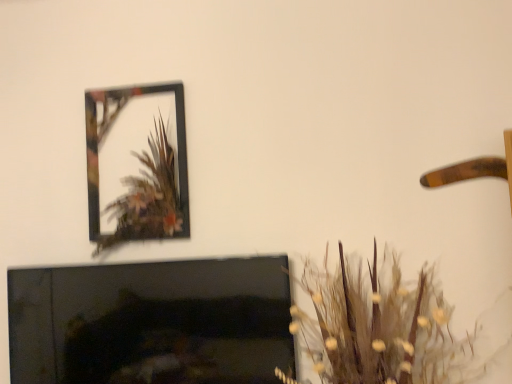
Describe the element at coordinates (106, 130) in the screenshot. The image size is (512, 384). I see `metallic frame at upper left` at that location.

This screenshot has width=512, height=384. In order to click on metallic frame at upper left in this screenshot , I will do `click(106, 130)`.

Between brown textured plant at lower right and metallic frame at upper left, which one is positioned behind?

metallic frame at upper left is further away from the camera.

From the image's perspective, is brown textured plant at lower right located above or below metallic frame at upper left?

Clearly, from the image's perspective, brown textured plant at lower right is below metallic frame at upper left.

Considering the sizes of objects brown textured plant at lower right and metallic frame at upper left in the image provided, who is shorter, brown textured plant at lower right or metallic frame at upper left?

brown textured plant at lower right.

Considering their positions, is brown textured plant at lower right located in front of or behind black glossy fireplace at lower left?

brown textured plant at lower right is in front of black glossy fireplace at lower left.

Is black glossy fireplace at lower left at the back of brown textured plant at lower right?

No, brown textured plant at lower right is not facing the opposite direction of black glossy fireplace at lower left.

Is brown textured plant at lower right at the right side of black glossy fireplace at lower left?

Correct, you'll find brown textured plant at lower right to the right of black glossy fireplace at lower left.

Locate an element on the screen. fireplace behind the brown textured plant at lower right is located at coordinates (151, 322).

Is metallic frame at upper left inside or outside of brown textured plant at lower right?

metallic frame at upper left cannot be found inside brown textured plant at lower right.

Considering the relative sizes of metallic frame at upper left and brown textured plant at lower right in the image provided, is metallic frame at upper left shorter than brown textured plant at lower right?

No.

Is metallic frame at upper left to the right of brown textured plant at lower right from the viewer's perspective?

No.

Measure the distance between black glossy fireplace at lower left and metallic frame at upper left.

They are 13.69 inches apart.

Identify the location of fireplace in front of the metallic frame at upper left. (151, 322).

In the scene shown: Can you confirm if black glossy fireplace at lower left is positioned to the right of metallic frame at upper left?

Correct, you'll find black glossy fireplace at lower left to the right of metallic frame at upper left.

Consider the image. Does black glossy fireplace at lower left contain metallic frame at upper left?

Definitely not — metallic frame at upper left is not inside black glossy fireplace at lower left.

Between black glossy fireplace at lower left and brown textured plant at lower right, which one has smaller width?

Thinner between the two is black glossy fireplace at lower left.

Is black glossy fireplace at lower left inside the boundaries of brown textured plant at lower right, or outside?

The correct answer is: outside.

How many degrees apart are the facing directions of black glossy fireplace at lower left and brown textured plant at lower right?

The angle between the facing direction of black glossy fireplace at lower left and the facing direction of brown textured plant at lower right is 0.8 degrees.

From a real-world perspective, which is physically above, metallic frame at upper left or black glossy fireplace at lower left?

metallic frame at upper left.

Could you tell me if metallic frame at upper left is facing black glossy fireplace at lower left?

No, metallic frame at upper left is not facing towards black glossy fireplace at lower left.

The height and width of the screenshot is (384, 512). In order to click on fireplace below the metallic frame at upper left (from a real-world perspective) in this screenshot , I will do `click(151, 322)`.

Which of these two, metallic frame at upper left or black glossy fireplace at lower left, is wider?

Wider between the two is metallic frame at upper left.

Where is `picture frame that appears above the brown textured plant at lower right (from the image's perspective)`? Image resolution: width=512 pixels, height=384 pixels. picture frame that appears above the brown textured plant at lower right (from the image's perspective) is located at coordinates (x=106, y=130).

What are the coordinates of `fireplace on the left of brown textured plant at lower right` in the screenshot? It's located at (151, 322).

Estimate the real-world distances between objects in this image. Which object is closer to brown textured plant at lower right, metallic frame at upper left or black glossy fireplace at lower left?

black glossy fireplace at lower left lies closer to brown textured plant at lower right than the other object.

Looking at the image, which one is located closer to metallic frame at upper left, brown textured plant at lower right or black glossy fireplace at lower left?

black glossy fireplace at lower left is closer to metallic frame at upper left.

Which object lies nearer to the anchor point black glossy fireplace at lower left, metallic frame at upper left or brown textured plant at lower right?

brown textured plant at lower right is closer to black glossy fireplace at lower left.

Based on their spatial positions, is brown textured plant at lower right or metallic frame at upper left closer to black glossy fireplace at lower left?

brown textured plant at lower right.

When comparing their distances from brown textured plant at lower right, does black glossy fireplace at lower left or metallic frame at upper left seem closer?

black glossy fireplace at lower left is positioned closer to the anchor brown textured plant at lower right.

From the image, which object appears to be nearer to metallic frame at upper left, black glossy fireplace at lower left or brown textured plant at lower right?

black glossy fireplace at lower left lies closer to metallic frame at upper left than the other object.

What are the coordinates of `fireplace between metallic frame at upper left and brown textured plant at lower right from left to right` in the screenshot? It's located at 151,322.